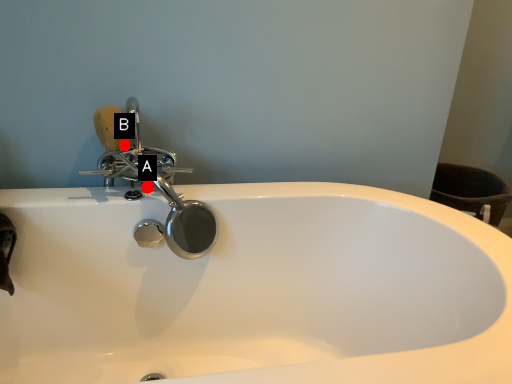
Question: Two points are circled on the image, labeled by A and B beside each circle. Which point is closer to the camera taking this photo?

Choices:
 (A) A is closer
 (B) B is closer

Answer: (B)